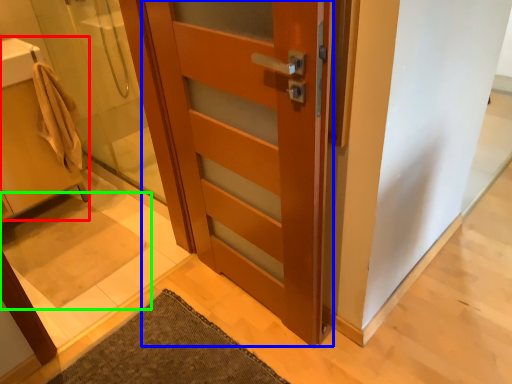
Question: Estimate the real-world distances between objects in this image. Which object is closer to sink (highlighted by a red box), door (highlighted by a blue box) or bath mat (highlighted by a green box)?

Choices:
 (A) door
 (B) bath mat

Answer: (B)